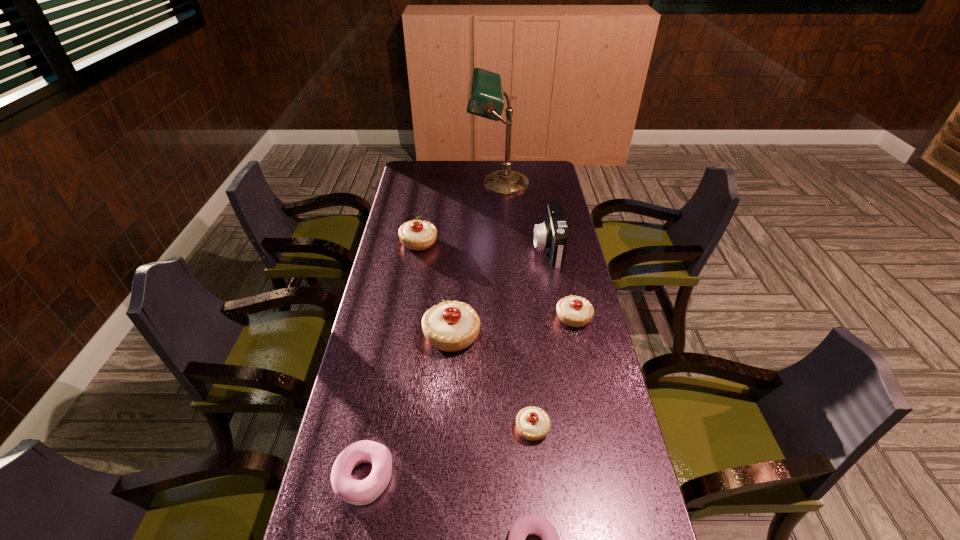
Locate an element on the screen. vacant space at the right edge is located at coordinates (622, 492).

Where is `vacant area between the rightmost pastry and the smallest beige pastry`? This screenshot has width=960, height=540. vacant area between the rightmost pastry and the smallest beige pastry is located at coordinates (x=553, y=373).

At what (x,y) coordinates should I click in order to perform the action: click on free spot between the camcorder and the fifth tallest pastry. Please return your answer as a coordinate pair (x, y). The height and width of the screenshot is (540, 960). Looking at the image, I should click on (456, 362).

Locate an element on the screen. free space between the fifth shortest pastry and the black camcorder is located at coordinates (484, 245).

Find the location of `free space between the third biggest beige pastry and the tallest object`. free space between the third biggest beige pastry and the tallest object is located at coordinates (536, 251).

The width and height of the screenshot is (960, 540). In order to click on object that ranks as the sixth closest to the black camcorder in this screenshot , I will do `click(357, 492)`.

Identify which object is the fifth closest to the tallest object. Please provide its 2D coordinates. Your answer should be formatted as a tuple, i.e. [(x, y)], where the tuple contains the x and y coordinates of a point satisfying the conditions above.

[(532, 423)]

Identify which pastry is the third nearest to the black camcorder. Please provide its 2D coordinates. Your answer should be formatted as a tuple, i.e. [(x, y)], where the tuple contains the x and y coordinates of a point satisfying the conditions above.

[(416, 235)]

Image resolution: width=960 pixels, height=540 pixels. I want to click on pastry object that ranks as the closest to the tallest pastry, so click(x=532, y=423).

Identify which beige pastry is the fourth closest to the tallest object. Please provide its 2D coordinates. Your answer should be formatted as a tuple, i.e. [(x, y)], where the tuple contains the x and y coordinates of a point satisfying the conditions above.

[(532, 423)]